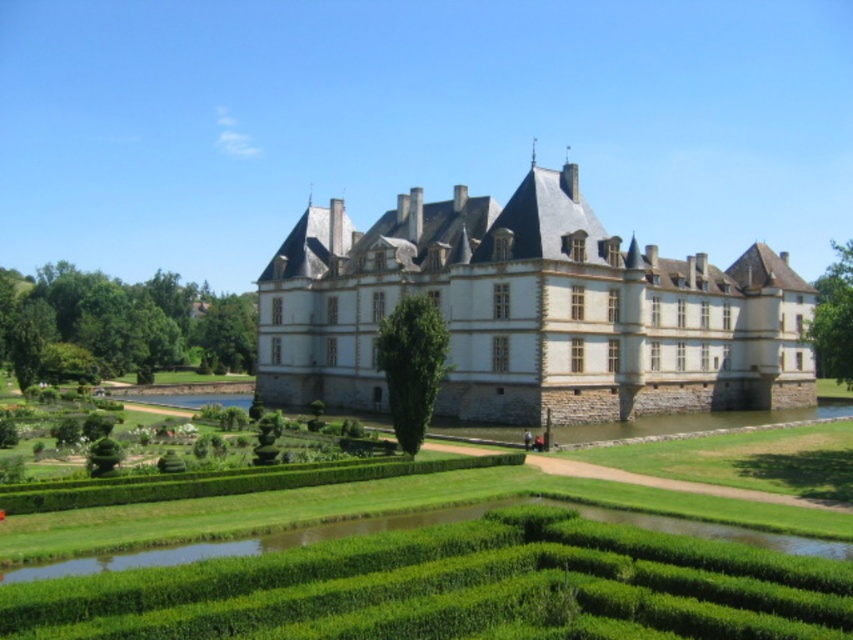
You are standing in the garden of the chateau and want to take a photo of the stone gray castle at center. However, there is a green leafy hedge at lower left in the way. Can you move to a position where the hedge won not block the view of the castle?

The stone gray castle at center is in front of the green leafy hedge at lower left, so the hedge is behind the castle. Therefore, you can take a photo of the castle without the hedge blocking the view because the hedge is behind it.

You are a visitor standing in front of the chateaux and see the green hedge at center and the green leafy hedge at lower left. Which hedge is closer to the moat?

The green leafy hedge at lower left is closer to the moat because the green hedge at center is positioned on the right side of it, placing it further away from the moat.

You are standing at the point marked as point (519, 284) and want to walk to the chateau entrance. The moat is 10 meters wide. Can you safely cross the moat without getting wet?

The distance between you and the chateau entrance is 84.09 meters, which includes the 10 meter width of the moat. Subtracting the moat width, you have 74.09 meters remaining. Since the moat is only 10 meters wide, you can safely cross it and continue walking the remaining distance to the entrance.